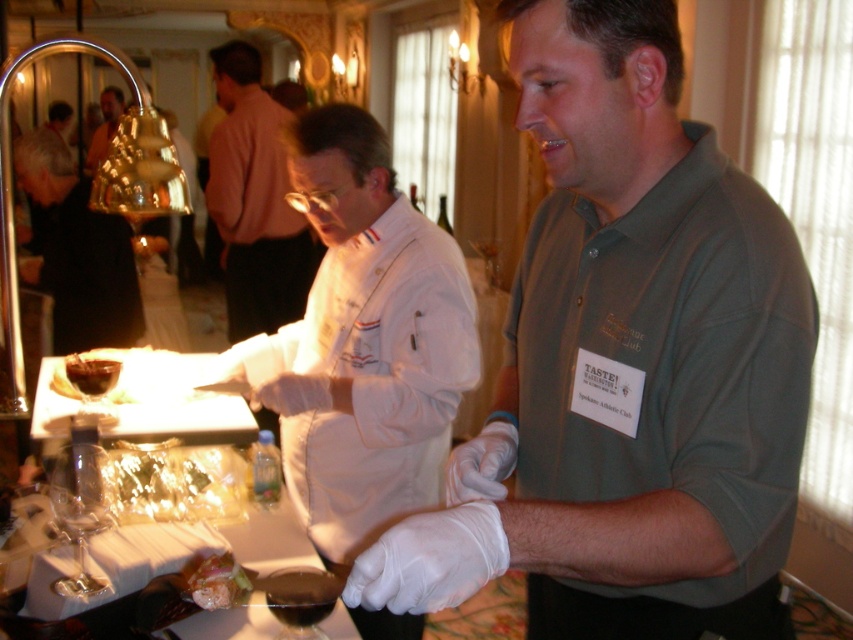
Can you confirm if white chef coat at center is positioned above black fabric at left?

Yes, white chef coat at center is above black fabric at left.

Measure the distance from white chef coat at center to black fabric at left.

The distance of white chef coat at center from black fabric at left is 1.04 meters.

Who is more forward, (253, 292) or (86, 257)?

Positioned in front is point (86, 257).

Locate an element on the screen. white chef coat at center is located at coordinates (254, 202).

Which of these two, white fabric chef coat at center or transparent glass wine glass at lower left, stands shorter?

With less height is transparent glass wine glass at lower left.

From the picture: Which is below, white fabric chef coat at center or transparent glass wine glass at lower left?

transparent glass wine glass at lower left is lower down.

Which is behind, point (334, 403) or point (67, 451)?

Point (334, 403)

I want to click on white fabric chef coat at center, so click(x=367, y=340).

Measure the distance between transparent glass wine glass at lower center and camera.

transparent glass wine glass at lower center is 1.23 meters away from camera.

Between transparent glass wine glass at lower center and matte gold bell at upper left, which one appears on the left side from the viewer's perspective?

From the viewer's perspective, matte gold bell at upper left appears more on the left side.

I want to click on transparent glass wine glass at lower center, so click(300, 600).